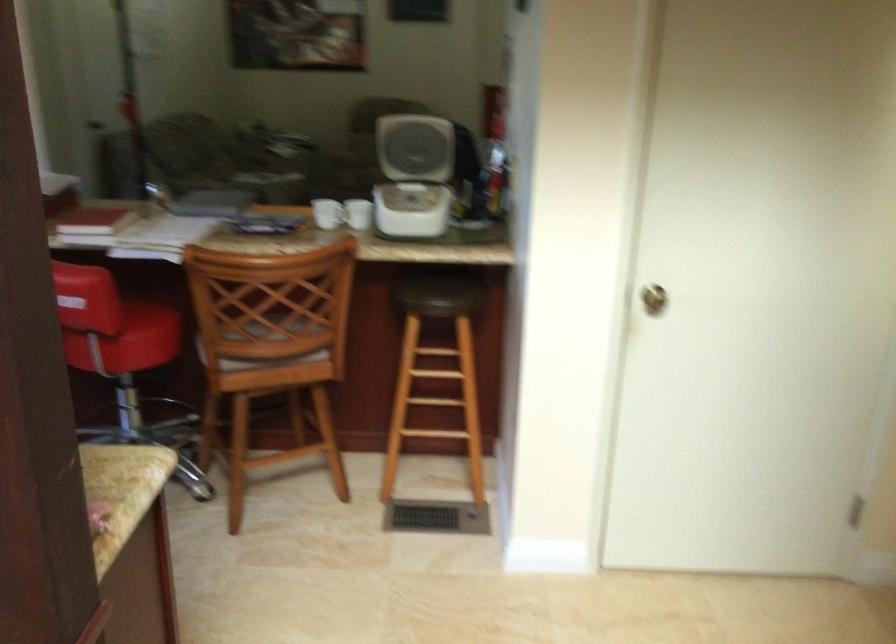
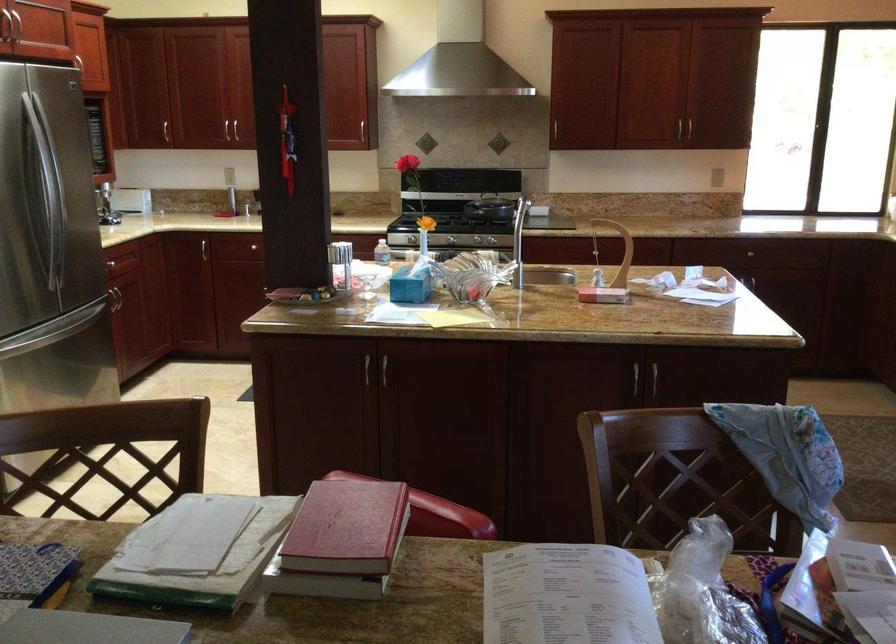
Question: I am providing you with two images of the same scene from different viewpoints. After the viewpoint changes to image2, which objects are now occluded?

Choices:
 (A) wooden chair sitting surface
 (B) small plastic bottle
 (C) red and silver pen
 (D) black stove knob

Answer: (A)